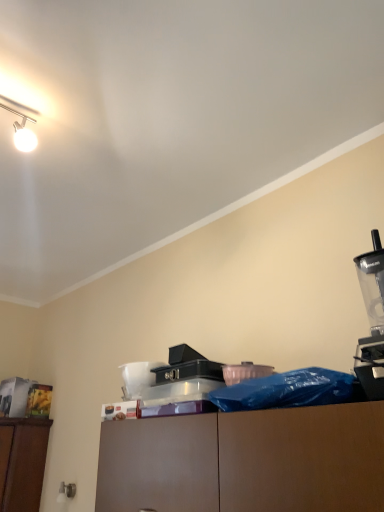
Question: Are transparent plastic blender at right and black plastic case at center making contact?

Choices:
 (A) yes
 (B) no

Answer: (B)

Question: Can you confirm if transparent plastic blender at right is positioned to the right of black plastic case at center?

Choices:
 (A) no
 (B) yes

Answer: (B)

Question: Can you confirm if transparent plastic blender at right is wider than black plastic case at center?

Choices:
 (A) no
 (B) yes

Answer: (B)

Question: From the image's perspective, is transparent plastic blender at right on top of black plastic case at center?

Choices:
 (A) no
 (B) yes

Answer: (B)

Question: Does transparent plastic blender at right have a lesser height compared to black plastic case at center?

Choices:
 (A) no
 (B) yes

Answer: (A)

Question: Is transparent plastic blender at right facing away from black plastic case at center?

Choices:
 (A) yes
 (B) no

Answer: (B)

Question: Is black plastic case at center oriented away from transparent plastic blender at right?

Choices:
 (A) yes
 (B) no

Answer: (B)

Question: Is black plastic case at center smaller than transparent plastic blender at right?

Choices:
 (A) yes
 (B) no

Answer: (A)

Question: Does black plastic case at center have a greater width compared to transparent plastic blender at right?

Choices:
 (A) yes
 (B) no

Answer: (B)

Question: From a real-world perspective, is black plastic case at center located higher than transparent plastic blender at right?

Choices:
 (A) no
 (B) yes

Answer: (A)

Question: Would you say black plastic case at center is outside transparent plastic blender at right?

Choices:
 (A) no
 (B) yes

Answer: (B)

Question: Is transparent plastic blender at right surrounded by black plastic case at center?

Choices:
 (A) no
 (B) yes

Answer: (A)

Question: Considering the positions of black plastic case at center and transparent plastic blender at right in the image, is black plastic case at center bigger or smaller than transparent plastic blender at right?

Choices:
 (A) small
 (B) big

Answer: (A)